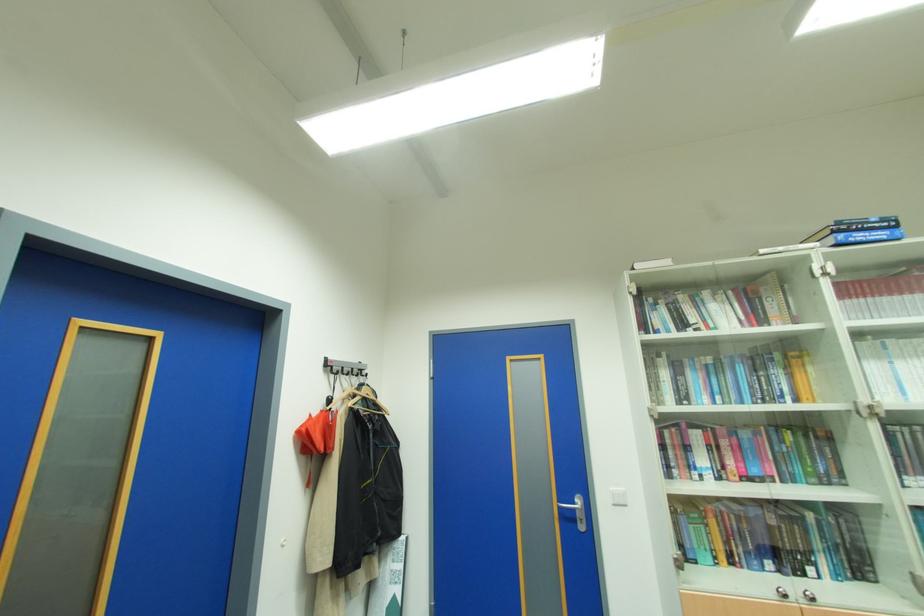
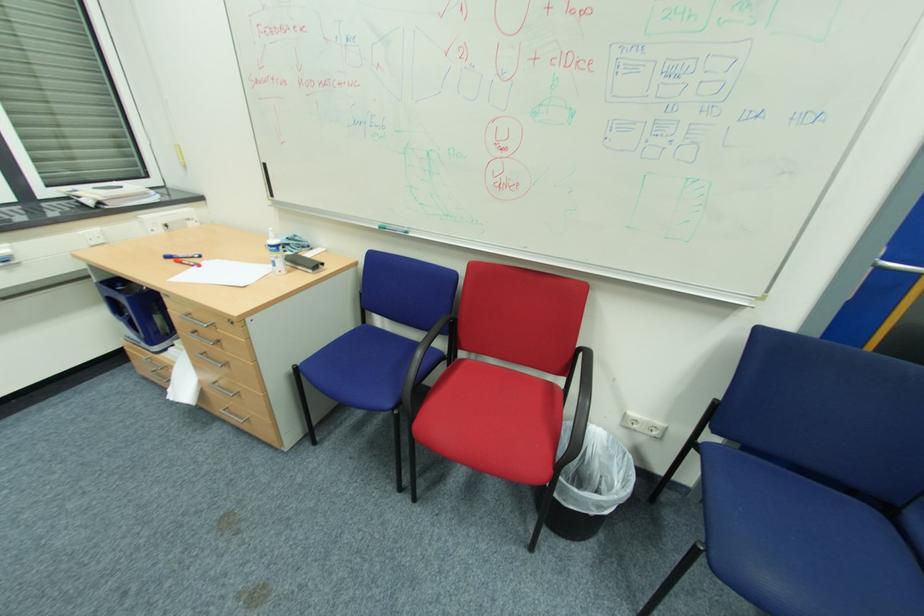
The first image is from the beginning of the video and the second image is from the end. How did the camera likely rotate when shooting the video?

The camera rotated toward left-down.